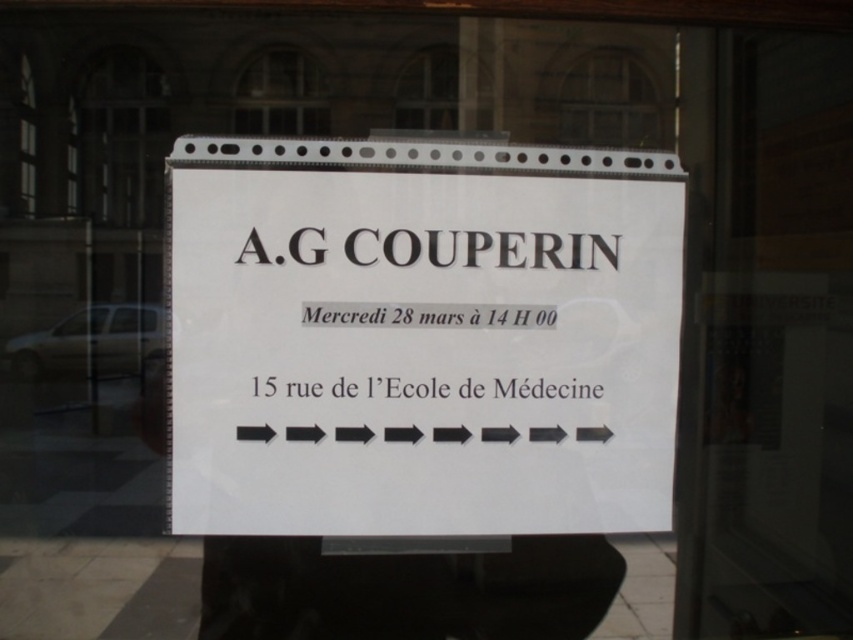
You are a delivery person trying to read the address on the white paper sign at center and the clear glass window at upper center. Which object has a larger surface area?

The white paper sign at center is larger in size than the clear glass window at upper center, so the white paper sign at center has a larger surface area.

You are a delivery person trying to locate the correct address for a package. You see the white paper sign at center and the transparent glass door at center. Which object should you interact with to enter the building?

The transparent glass door at center is the entrance, so you should interact with the transparent glass door at center to enter the building.